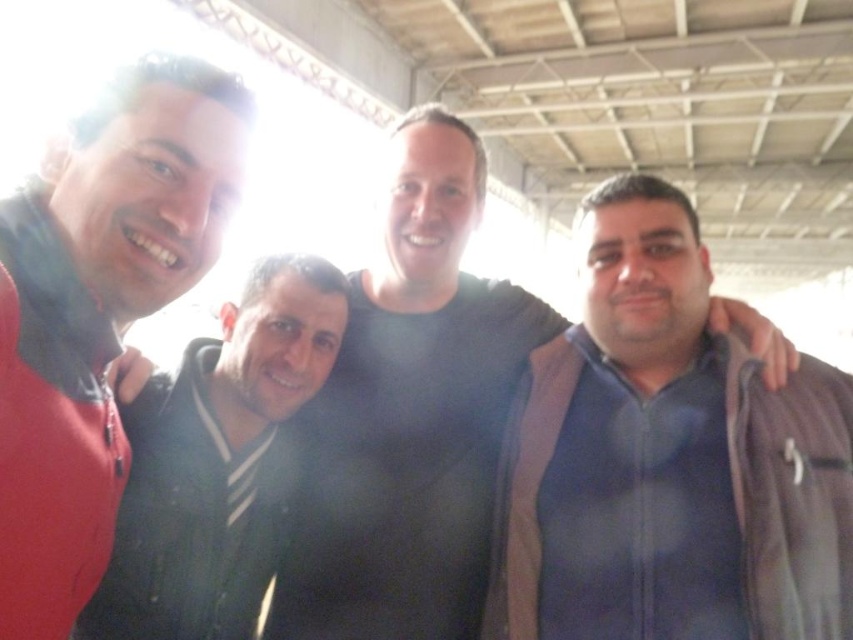
You are an observer looking at the four people in the scene. Which of the two items, the black matte shirt at center or the dark gray hoodie at center, is positioned higher on the person?

The black matte shirt at center is positioned higher than the dark gray hoodie at center because it is described as being above it.